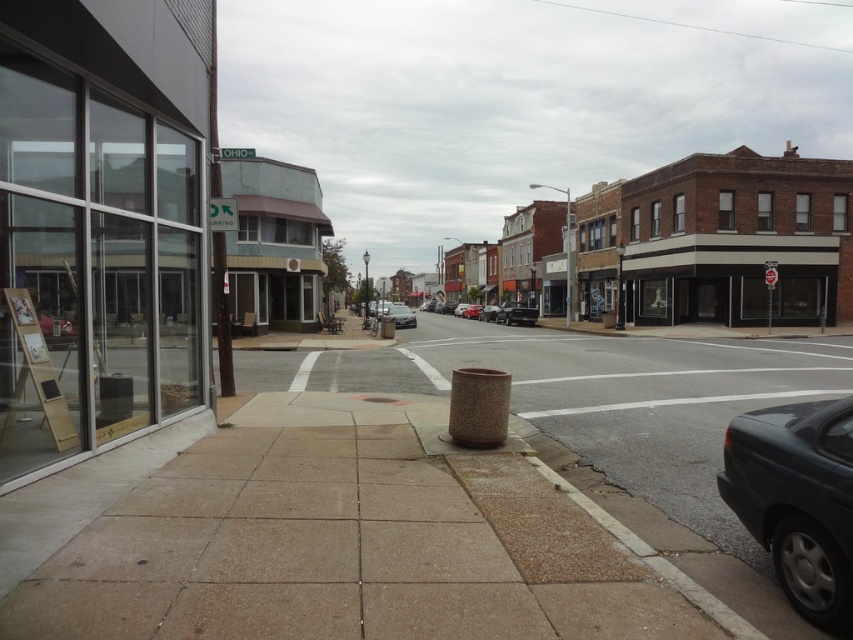
Question: Is brick building at center above dark gray metallic car at lower right?

Choices:
 (A) yes
 (B) no

Answer: (A)

Question: Can you confirm if matte white building at center is bigger than shiny black truck at center?

Choices:
 (A) yes
 (B) no

Answer: (A)

Question: Which object is closer to the camera taking this photo?

Choices:
 (A) shiny black sedan at center
 (B) brown concrete sidewalk at center
 (C) shiny black truck at center

Answer: (B)

Question: Estimate the real-world distances between objects in this image. Which object is farther from the matte white storefront at center?

Choices:
 (A) shiny black truck at center
 (B) brick building at center

Answer: (A)

Question: Can you confirm if brown concrete sidewalk at center is positioned to the right of matte white building at center?

Choices:
 (A) no
 (B) yes

Answer: (B)

Question: Which point is closer to the camera?

Choices:
 (A) (834, 221)
 (B) (480, 310)
 (C) (503, 554)

Answer: (C)